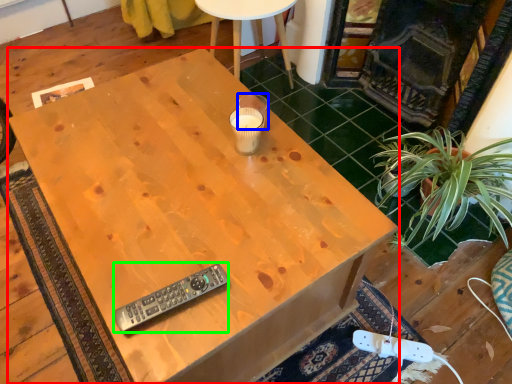
Question: Which object is positioned closest to desk (highlighted by a red box)? Select from coffee cup (highlighted by a blue box) and remote control (highlighted by a green box).

Choices:
 (A) coffee cup
 (B) remote control

Answer: (B)